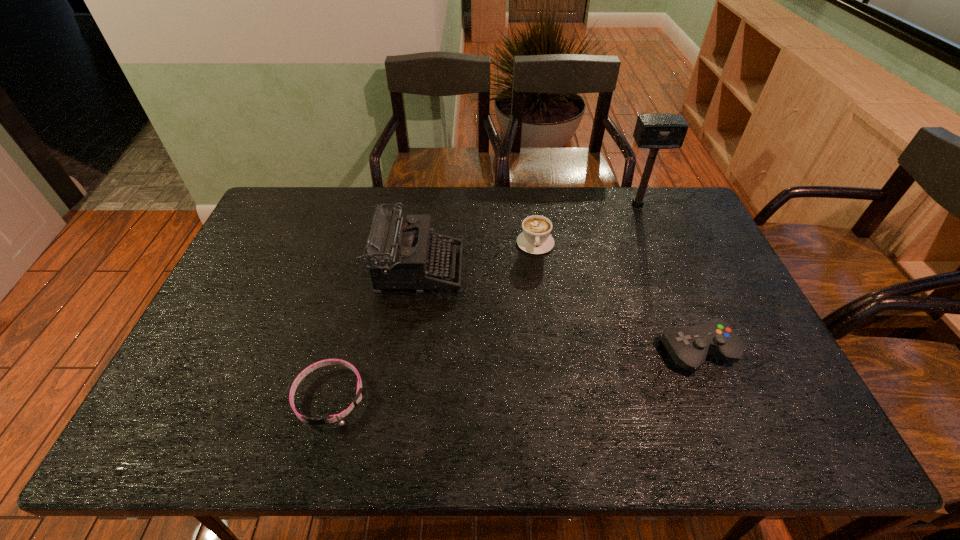
I want to click on object that is at the far edge, so click(x=654, y=131).

This screenshot has height=540, width=960. I want to click on object that is at the near edge, so click(359, 393).

Locate an element on the screen. mallet present at the right edge is located at coordinates (654, 131).

The image size is (960, 540). I want to click on control at the right edge, so click(688, 346).

Identify the location of object that is at the far right corner. This screenshot has width=960, height=540. (654, 131).

Find the location of a particular element. Image resolution: width=960 pixels, height=540 pixels. vacant space at the far edge of the desktop is located at coordinates (525, 195).

Find the location of a particular element. The image size is (960, 540). vacant area at the left edge of the desktop is located at coordinates (206, 321).

The width and height of the screenshot is (960, 540). I want to click on vacant space at the right edge of the desktop, so click(x=751, y=369).

I want to click on free region at the far right corner of the desktop, so click(673, 193).

This screenshot has height=540, width=960. I want to click on vacant space at the near right corner, so click(745, 416).